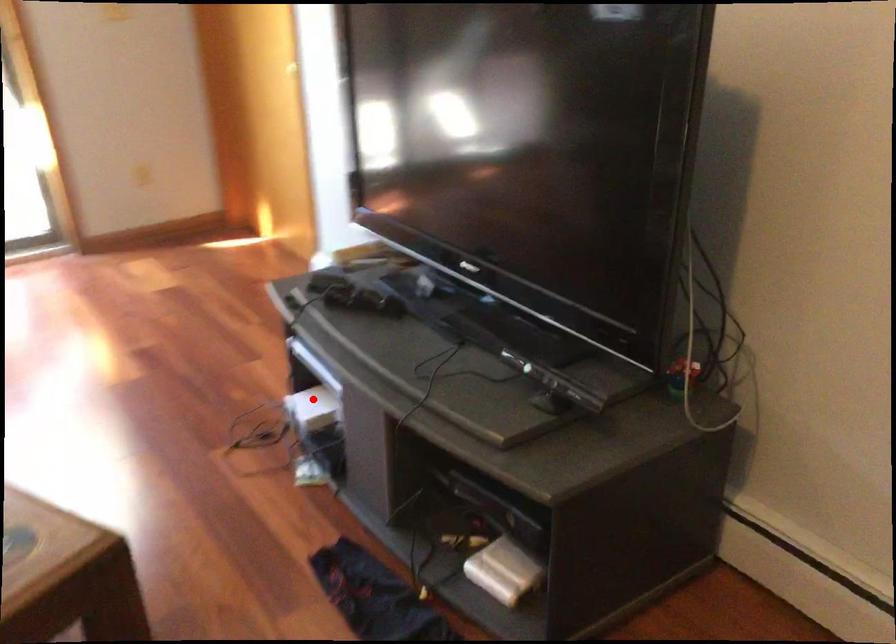
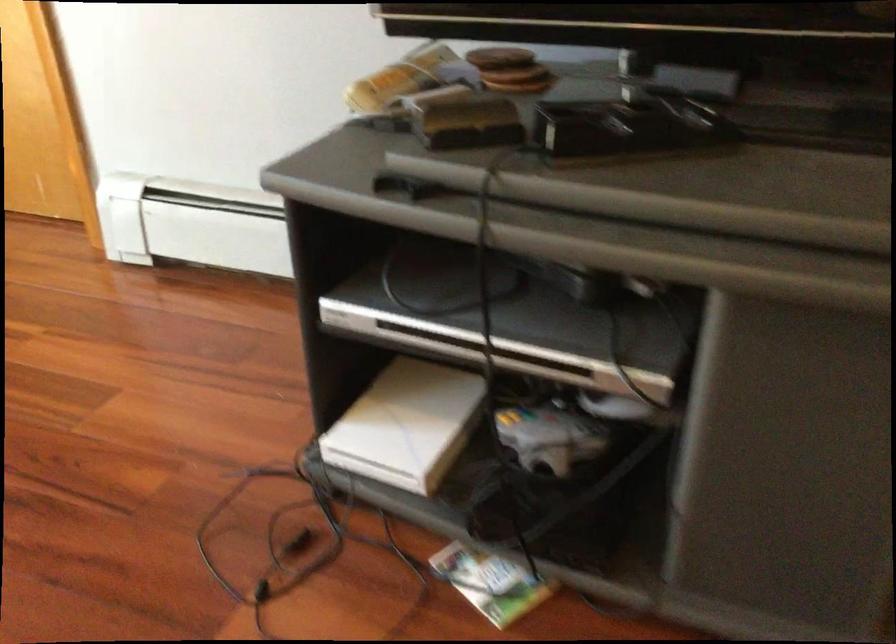
Question: I am providing you with two images of the same scene from different viewpoints. Given a red point in image1, look at the same physical point in image2. Is it:

Choices:
 (A) Closer to the viewpoint
 (B) Farther from the viewpoint

Answer: (A)